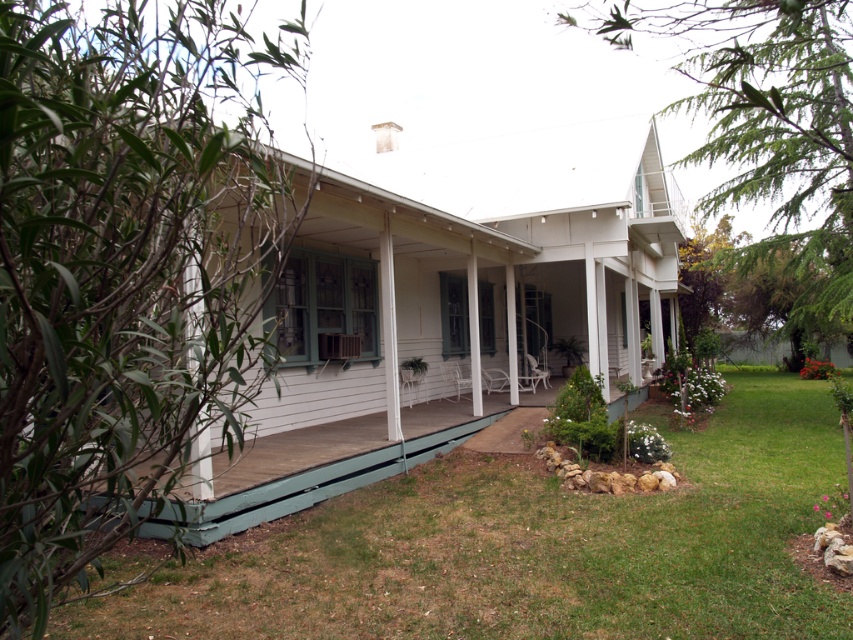
You are standing on the front lawn of the house and looking towards the porch and pillars. Which object is positioned lower in the image, the green painted wood porch at lower left or the white wood pillar at left?

The green painted wood porch at lower left is positioned below the white wood pillar at left, so it is lower in the image.

You are a delivery person standing at the entrance of the property. You need to deliver a package to the house. The path from the entrance to the house goes past the green painted wood porch at lower left. If your delivery cart is 2 meters wide, will it fit through the space between the porch and the house?

The distance between the green painted wood porch at lower left and the camera is 5.50 meters. Since the delivery cart is only 2 meters wide, it will easily fit through the space as the distance is more than sufficient.